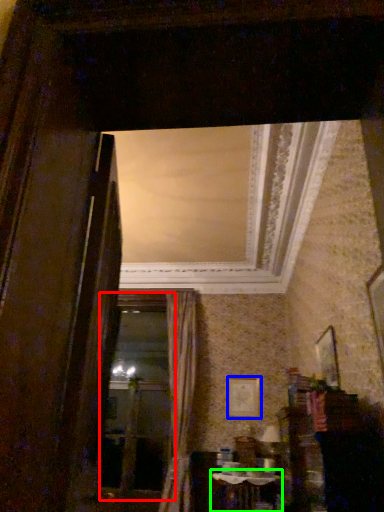
Question: Considering the real-world distances, which object is farthest from window frame (highlighted by a red box)? picture frame (highlighted by a blue box) or table (highlighted by a green box)?

Choices:
 (A) picture frame
 (B) table

Answer: (B)